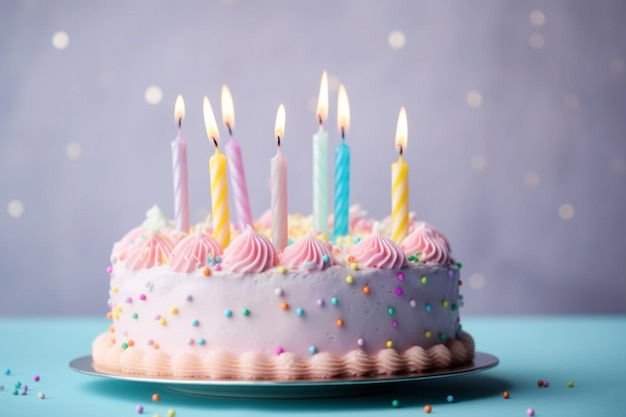
At what (x,y) coordinates should I click in order to perform the action: click on birthday cake candles. Please return your answer as a coordinate pair (x, y). This screenshot has width=626, height=417. Looking at the image, I should click on (396, 195), (335, 202), (324, 181), (285, 193), (243, 191), (213, 201), (175, 180).